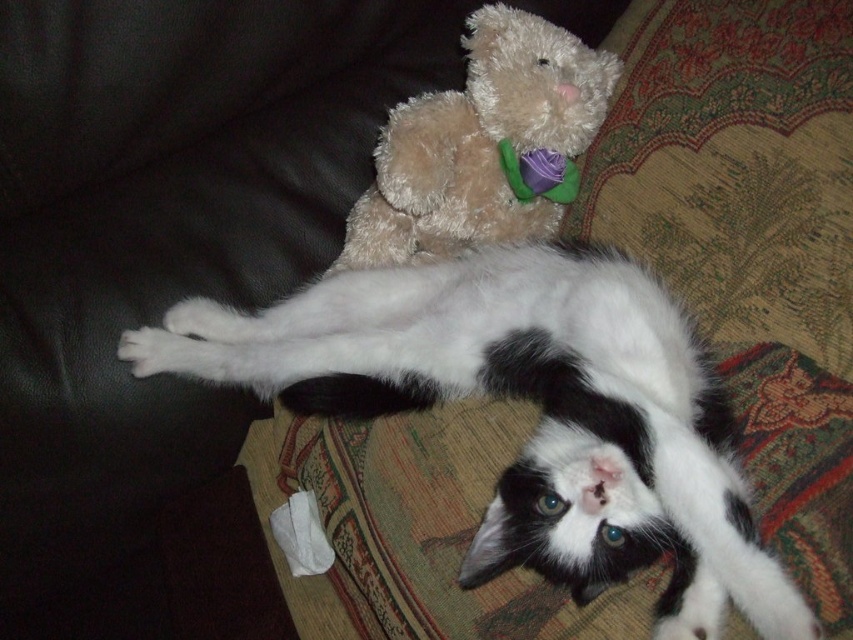
Question: Which point is closer to the camera?

Choices:
 (A) (508, 392)
 (B) (399, 186)

Answer: (A)

Question: Does white soft fur cat at center appear under fuzzy brown teddy bear at upper center?

Choices:
 (A) yes
 (B) no

Answer: (A)

Question: Which object is closer to the camera taking this photo?

Choices:
 (A) fuzzy brown teddy bear at upper center
 (B) white soft fur cat at center

Answer: (B)

Question: Is white soft fur cat at center bigger than fuzzy brown teddy bear at upper center?

Choices:
 (A) yes
 (B) no

Answer: (A)

Question: Is white soft fur cat at center closer to camera compared to fuzzy brown teddy bear at upper center?

Choices:
 (A) no
 (B) yes

Answer: (B)